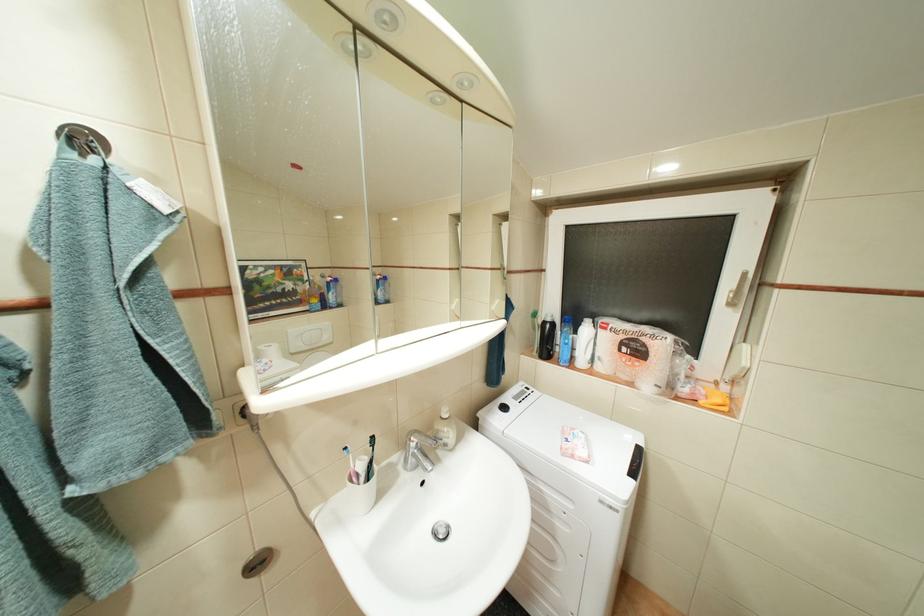
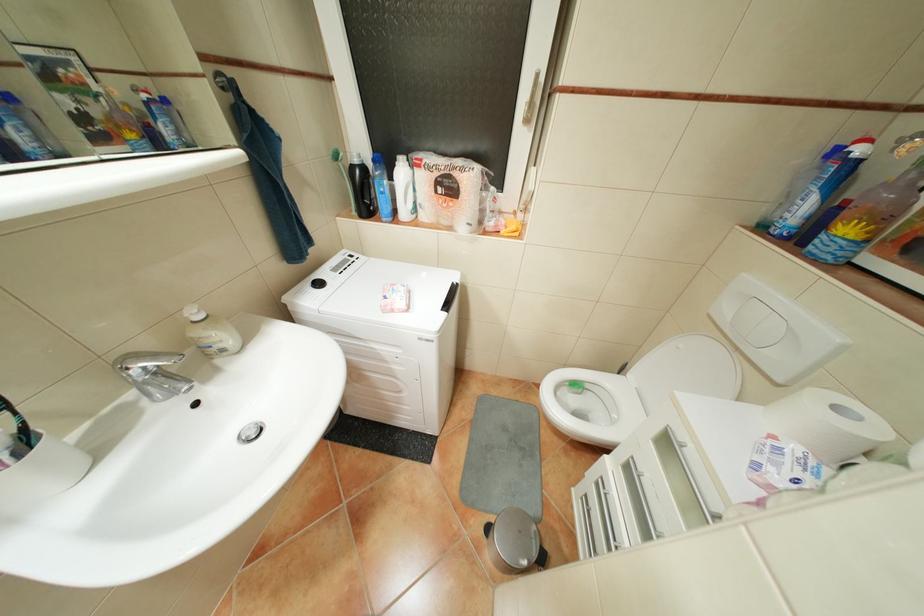
In the second image, find the point that corresponds to (x=456, y=445) in the first image.

(233, 350)